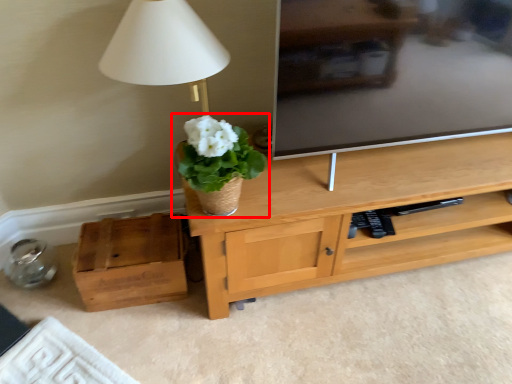
Question: In this image, where is houseplant (annotated by the red box) located relative to box?

Choices:
 (A) right
 (B) left

Answer: (A)